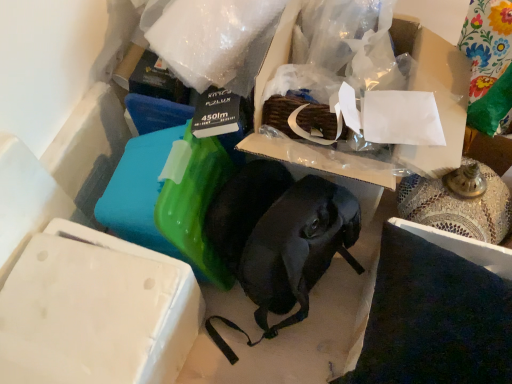
Question: From the image's perspective, relative to white matte box at lower left, is matte cardboard box at center above or below?

Choices:
 (A) below
 (B) above

Answer: (B)

Question: Is matte cardboard box at center to the left or to the right of white matte box at lower left in the image?

Choices:
 (A) left
 (B) right

Answer: (B)

Question: From their relative heights in the image, would you say matte cardboard box at center is taller or shorter than white matte box at lower left?

Choices:
 (A) short
 (B) tall

Answer: (B)

Question: From the image's perspective, relative to matte cardboard box at center, is white matte box at lower left above or below?

Choices:
 (A) below
 (B) above

Answer: (A)

Question: Visually, is white matte box at lower left positioned to the left or to the right of matte cardboard box at center?

Choices:
 (A) right
 (B) left

Answer: (B)

Question: Considering their positions, is white matte box at lower left located in front of or behind matte cardboard box at center?

Choices:
 (A) front
 (B) behind

Answer: (A)

Question: Based on their sizes in the image, would you say white matte box at lower left is bigger or smaller than matte cardboard box at center?

Choices:
 (A) big
 (B) small

Answer: (B)